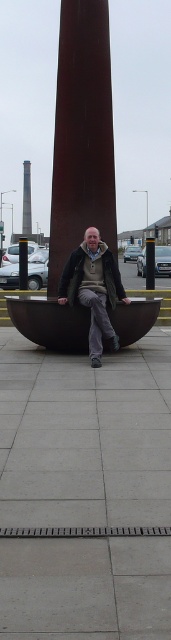
Is matte gray jacket at center to the right of smooth brown tower at center from the viewer's perspective?

Indeed, matte gray jacket at center is positioned on the right side of smooth brown tower at center.

Can you confirm if matte gray jacket at center is positioned above smooth brown tower at center?

No.

Identify the location of matte gray jacket at center. The height and width of the screenshot is (640, 171). (93, 289).

Locate an element on the screen. matte gray jacket at center is located at coordinates (93, 289).

Does rustic metal sculpture at center come behind matte brown boat at center?

Yes, it is behind matte brown boat at center.

Locate an element on the screen. rustic metal sculpture at center is located at coordinates (82, 134).

Describe the element at coordinates (82, 134) in the screenshot. This screenshot has width=171, height=640. I see `rustic metal sculpture at center` at that location.

Identify the location of rustic metal sculpture at center. The image size is (171, 640). (82, 134).

Can you confirm if rustic metal sculpture at center is smaller than smooth brown tower at center?

Indeed, rustic metal sculpture at center has a smaller size compared to smooth brown tower at center.

Who is more forward, (77, 45) or (30, 230)?

Point (77, 45) is more forward.

Where is `rustic metal sculpture at center`? rustic metal sculpture at center is located at coordinates (82, 134).